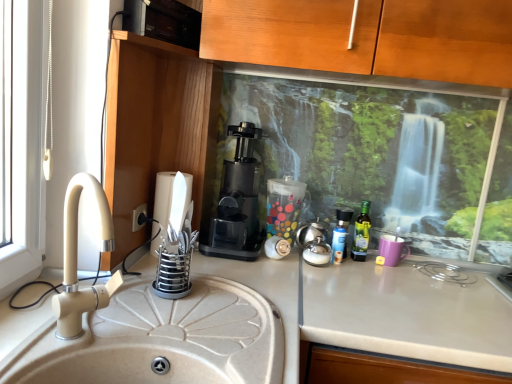
Question: Is white matte countertop at center smaller than green glass bottle at right, the first bottle in the right-to-left sequence?

Choices:
 (A) no
 (B) yes

Answer: (A)

Question: Is white matte countertop at center to the left of green glass bottle at right, the first bottle in the right-to-left sequence, from the viewer's perspective?

Choices:
 (A) no
 (B) yes

Answer: (A)

Question: Does white matte countertop at center lie in front of green glass bottle at right, the first bottle in the right-to-left sequence?

Choices:
 (A) yes
 (B) no

Answer: (A)

Question: Is green glass bottle at right, which is counted as the second bottle, starting from the left, a part of white matte countertop at center?

Choices:
 (A) yes
 (B) no

Answer: (B)

Question: From a real-world perspective, does white matte countertop at center sit lower than green glass bottle at right, the first bottle in the right-to-left sequence?

Choices:
 (A) no
 (B) yes

Answer: (B)

Question: Considering the relative sizes of white matte countertop at center and green glass bottle at right, the first bottle in the right-to-left sequence, in the image provided, is white matte countertop at center wider than green glass bottle at right, the first bottle in the right-to-left sequence,?

Choices:
 (A) yes
 (B) no

Answer: (A)

Question: Considering the relative sizes of black plastic electric outlet at lower left and beige ceramic sink at left in the image provided, is black plastic electric outlet at lower left thinner than beige ceramic sink at left?

Choices:
 (A) no
 (B) yes

Answer: (B)

Question: From the image's perspective, is black plastic electric outlet at lower left on beige ceramic sink at left?

Choices:
 (A) yes
 (B) no

Answer: (A)

Question: Does black plastic electric outlet at lower left appear on the right side of beige ceramic sink at left?

Choices:
 (A) yes
 (B) no

Answer: (B)

Question: Is black plastic electric outlet at lower left positioned beyond the bounds of beige ceramic sink at left?

Choices:
 (A) no
 (B) yes

Answer: (B)

Question: From a real-world perspective, does black plastic electric outlet at lower left stand above beige ceramic sink at left?

Choices:
 (A) yes
 (B) no

Answer: (B)

Question: Is black plastic electric outlet at lower left at the left side of beige ceramic sink at left?

Choices:
 (A) no
 (B) yes

Answer: (B)

Question: Is white matte countertop at center not close to beige ceramic sink at left?

Choices:
 (A) yes
 (B) no

Answer: (B)